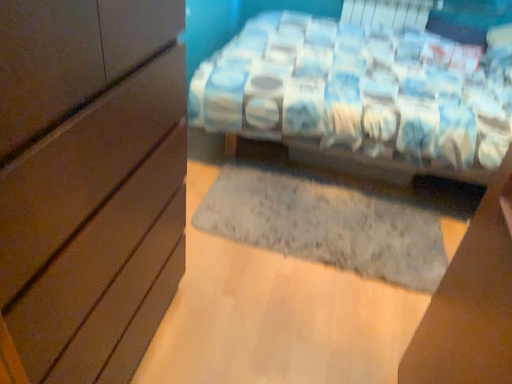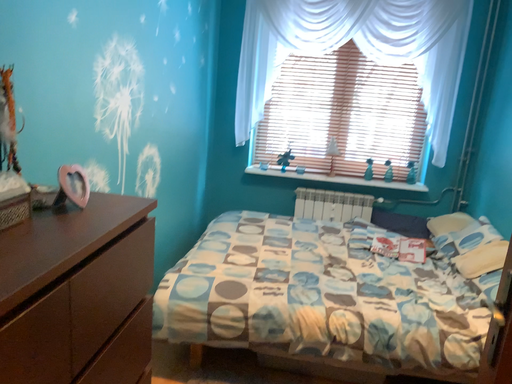
Question: How did the camera likely rotate when shooting the video?

Choices:
 (A) rotated upward
 (B) rotated downward

Answer: (A)